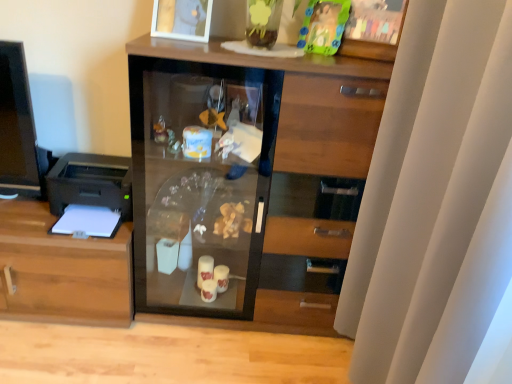
Question: Does point (49, 203) appear closer or farther from the camera than point (78, 269)?

Choices:
 (A) farther
 (B) closer

Answer: (A)

Question: Is black plastic printer at left wider or thinner than wooden cabinet at left?

Choices:
 (A) wide
 (B) thin

Answer: (B)

Question: Considering the real-world distances, which object is closest to the black plastic printer at left?

Choices:
 (A) white matte curtain at right
 (B) transparent glass cabinet at center
 (C) wooden cabinet at left
 (D) white glossy picture frame at upper center
 (E) translucent plastic toy at upper center

Answer: (C)

Question: Which is farther from the white glossy picture frame at upper center?

Choices:
 (A) white matte curtain at right
 (B) translucent plastic toy at upper center
 (C) black plastic printer at left
 (D) transparent glass cabinet at center
 (E) wooden cabinet at left

Answer: (E)